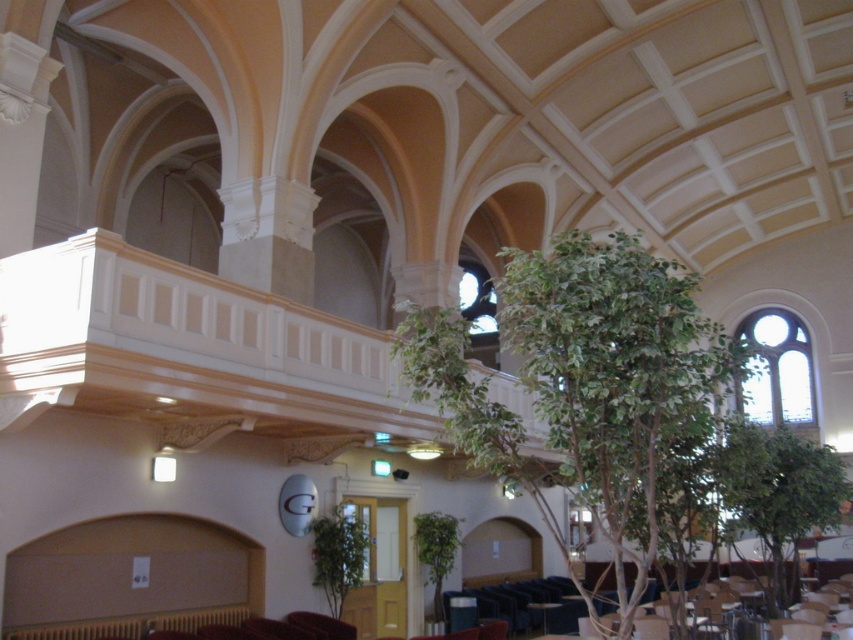
You are standing in the grand building and want to take a photo of both point (583, 328) and point (764, 436). Which point should you focus on first to ensure both are in the frame?

You should focus on point (583, 328) first because it is closer to the camera than point (764, 436). By focusing on the closer point, the depth of field may allow both points to be in focus.

You are an interior designer planning to install a large chandelier in the grand building. The chandelier needs to be placed above the green leafy tree at center and the green leafy tree at lower right. Considering their heights, which tree should the chandelier be positioned closer to?

The green leafy tree at center has a greater height compared to green leafy tree at lower right, so the chandelier should be positioned closer to the green leafy tree at center to ensure proper clearance and balance.